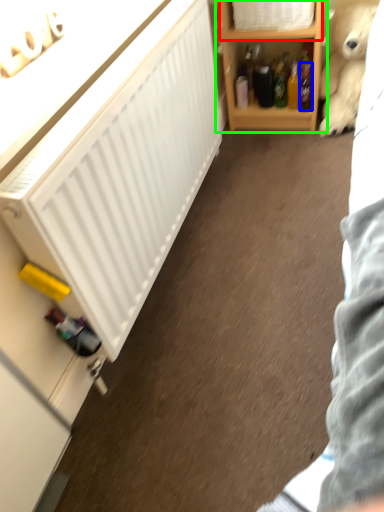
Question: Based on their relative distances, which object is farther from cabinet (highlighted by a red box)? Choose from bottle (highlighted by a blue box) and shelf (highlighted by a green box).

Choices:
 (A) bottle
 (B) shelf

Answer: (A)